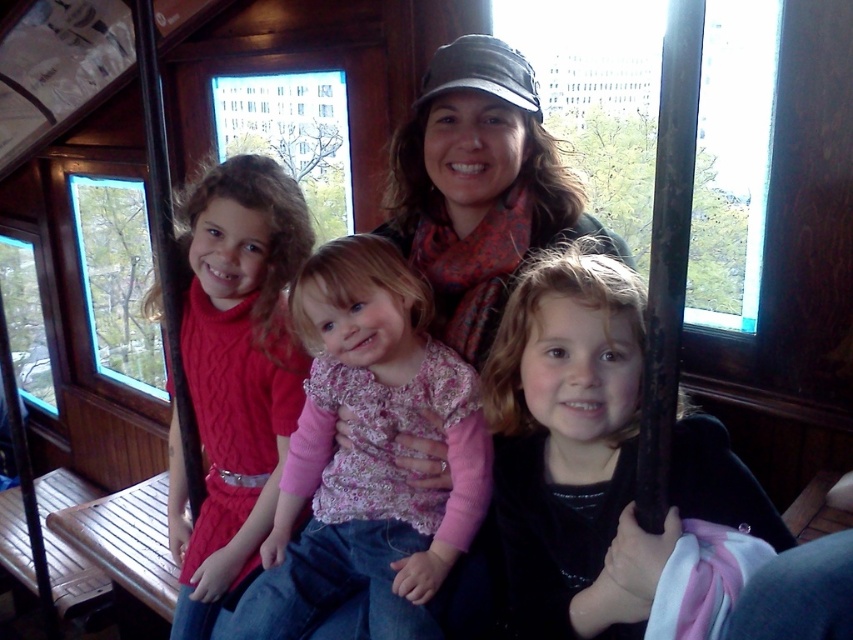
Does black velvet jacket at lower right appear over cable-knit sweater at left?

Actually, black velvet jacket at lower right is below cable-knit sweater at left.

Who is shorter, black velvet jacket at lower right or cable-knit sweater at left?

black velvet jacket at lower right

Which is in front, point (567, 600) or point (233, 486)?

Point (567, 600)

The image size is (853, 640). What are the coordinates of `black velvet jacket at lower right` in the screenshot? It's located at (605, 467).

Is point (741, 70) behind point (114, 268)?

No.

Is transparent glass window at upper center to the right of clear glass window at left from the viewer's perspective?

Correct, you'll find transparent glass window at upper center to the right of clear glass window at left.

Does point (729, 19) lie behind point (105, 196)?

No, it is not.

Locate an element on the screen. Image resolution: width=853 pixels, height=640 pixels. transparent glass window at upper center is located at coordinates (598, 93).

Between clear glass window at left and transparent glass window at upper left, which one appears on the right side from the viewer's perspective?

clear glass window at left is more to the right.

Is clear glass window at left taller than transparent glass window at upper left?

Yes.

What do you see at coordinates (117, 280) in the screenshot?
I see `clear glass window at left` at bounding box center [117, 280].

Find the location of a particular element. This screenshot has width=853, height=640. clear glass window at left is located at coordinates (117, 280).